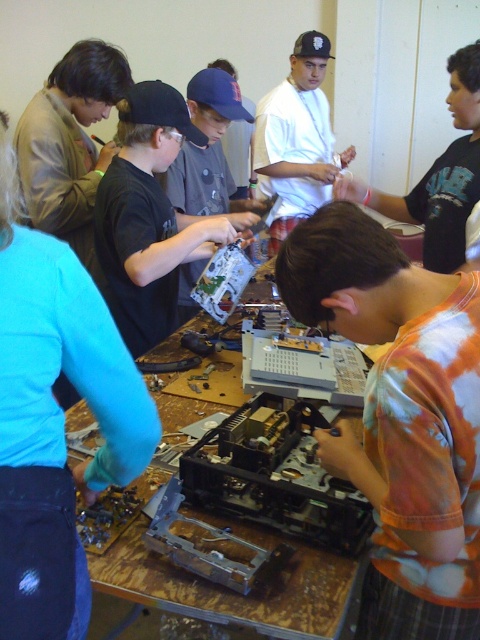
Question: Does wooden table at center appear on the left side of white matte shirt at center?

Choices:
 (A) no
 (B) yes

Answer: (B)

Question: Which point is closer to the camera taking this photo?

Choices:
 (A) [x=129, y=454]
 (B) [x=317, y=124]
 (C) [x=311, y=624]

Answer: (A)

Question: Can you confirm if wooden table at center is wider than white matte shirt at center?

Choices:
 (A) no
 (B) yes

Answer: (B)

Question: Which point appears closest to the camera in this image?

Choices:
 (A) pyautogui.click(x=61, y=516)
 (B) pyautogui.click(x=312, y=172)
 (C) pyautogui.click(x=168, y=355)

Answer: (A)

Question: Which object is the closest to the white matte shirt at center?

Choices:
 (A) wooden table at center
 (B) brushed metal circuit board at lower left

Answer: (A)

Question: Is wooden table at center further to camera compared to white matte shirt at center?

Choices:
 (A) no
 (B) yes

Answer: (A)